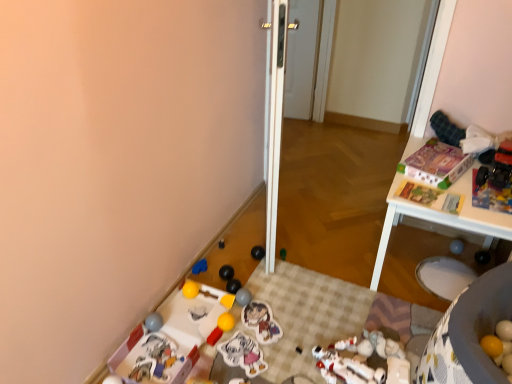
The width and height of the screenshot is (512, 384). What are the coordinates of `free spot to the left of matte plastic sticker at center, placed as the ninth toy when sorted from right to left` in the screenshot? It's located at (197, 347).